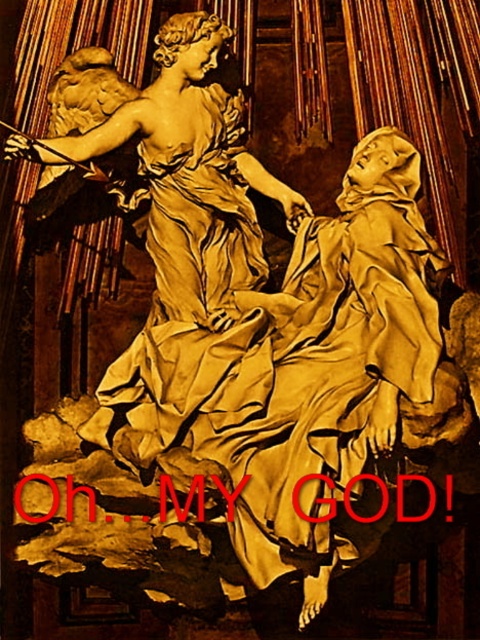
Question: Can you confirm if matte gold robe at center is positioned above matte gold statue at upper center?

Choices:
 (A) no
 (B) yes

Answer: (A)

Question: Does matte gold robe at center have a greater width compared to matte gold statue at upper center?

Choices:
 (A) no
 (B) yes

Answer: (A)

Question: Which object appears farthest from the camera in this image?

Choices:
 (A) matte gold robe at center
 (B) matte gold statue at upper center

Answer: (B)

Question: Is matte gold robe at center smaller than matte gold statue at upper center?

Choices:
 (A) no
 (B) yes

Answer: (A)